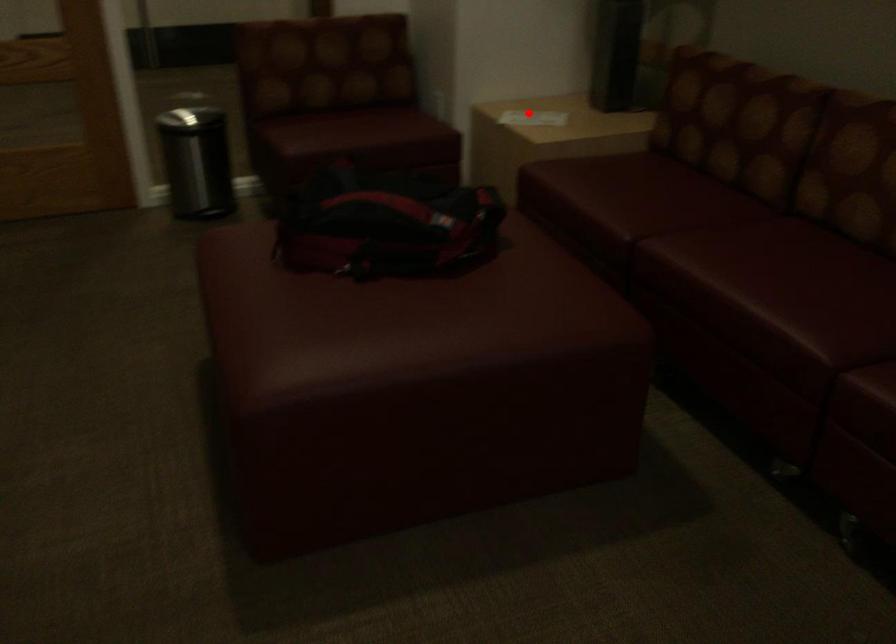
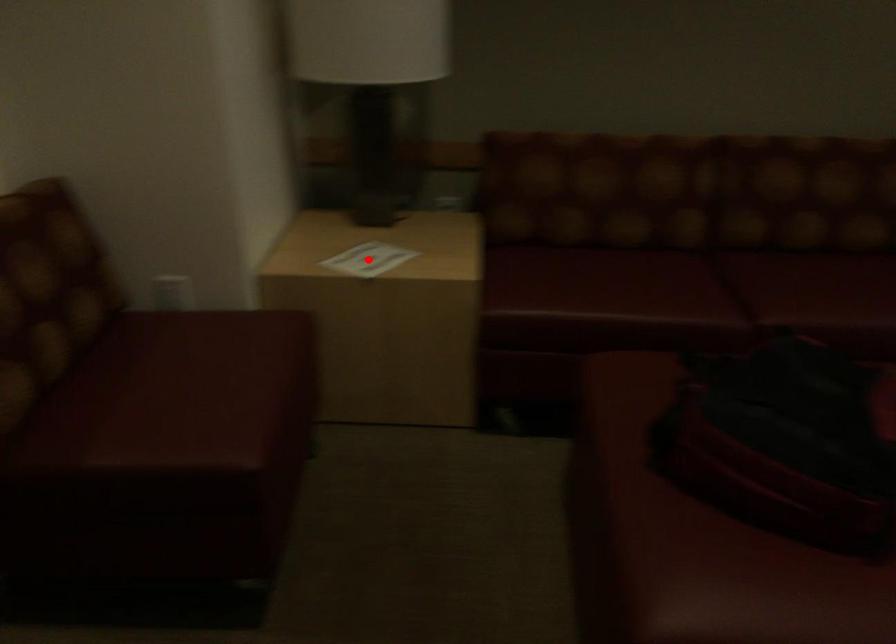
I am providing you with two images of the same scene from different viewpoints. A red point is marked on the first image and another point is marked on the second image. Is the red point in image1 aligned with the point shown in image2?

Yes